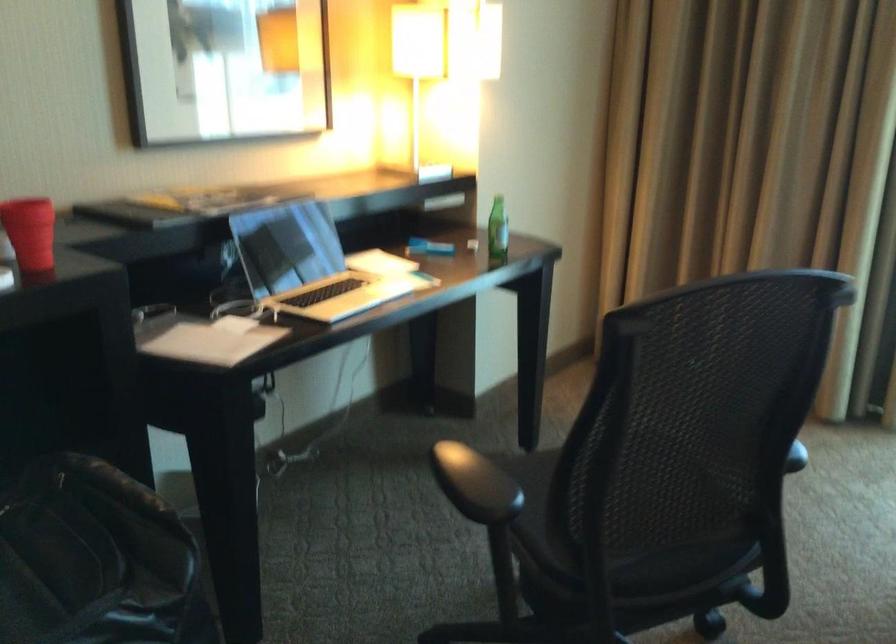
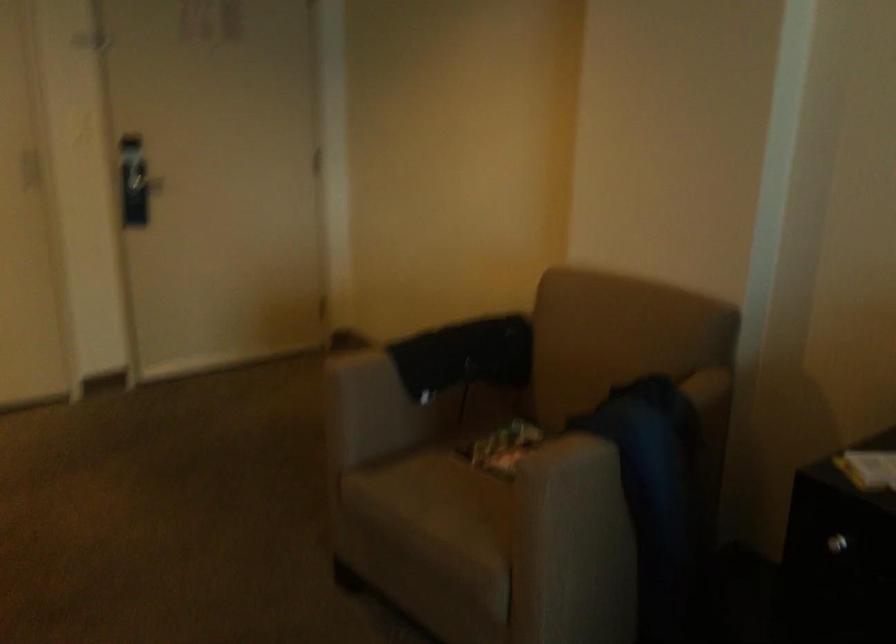
First-person continuous shooting, in which direction is the camera rotating?

The camera's rotation is toward left-down.